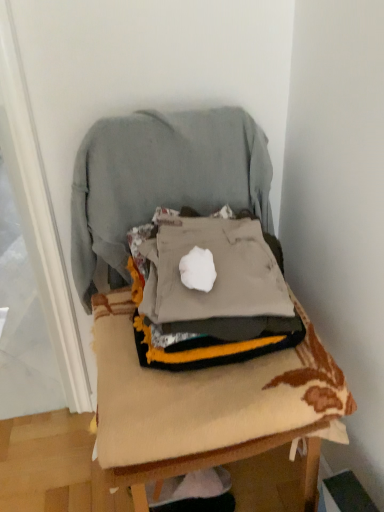
Describe the element at coordinates (203, 395) in the screenshot. This screenshot has width=384, height=512. I see `gray fabric at center` at that location.

Where is `gray cotton sweatshirt at center`? gray cotton sweatshirt at center is located at coordinates (160, 180).

From the picture: Is textured beige cushion at center at the left side of gray fabric at center?

Indeed, textured beige cushion at center is positioned on the left side of gray fabric at center.

Can you confirm if textured beige cushion at center is bigger than gray fabric at center?

Yes.

From the image's perspective, relative to gray fabric at center, is textured beige cushion at center above or below?

From the image's perspective, textured beige cushion at center appears above gray fabric at center.

Would you consider textured beige cushion at center to be distant from gray fabric at center?

That's not correct — textured beige cushion at center is a little close to gray fabric at center.

Is textured beige cushion at center oriented away from gray cotton sweatshirt at center?

Yes.

This screenshot has height=512, width=384. Identify the location of sweatshirt to the left of textured beige cushion at center. (160, 180).

From the image's perspective, does textured beige cushion at center appear lower than gray cotton sweatshirt at center?

Yes, from the image's perspective, textured beige cushion at center is below gray cotton sweatshirt at center.

How many degrees apart are the facing directions of textured beige cushion at center and gray cotton sweatshirt at center?

The angular difference between textured beige cushion at center and gray cotton sweatshirt at center is 0.00379 degrees.

Is gray cotton sweatshirt at center positioned with its back to textured beige cushion at center?

That's right, gray cotton sweatshirt at center is facing away from textured beige cushion at center.

Is gray cotton sweatshirt at center wider than textured beige cushion at center?

No, gray cotton sweatshirt at center is not wider than textured beige cushion at center.

Which is in front, point (190, 151) or point (309, 488)?

Point (190, 151)

Which object is wider, gray fabric at center or textured beige cushion at center?

textured beige cushion at center is wider.

From the image's perspective, would you say gray fabric at center is positioned over textured beige cushion at center?

Actually, gray fabric at center appears below textured beige cushion at center in the image.

How different are the orientations of gray fabric at center and gray cotton sweatshirt at center in degrees?

gray fabric at center and gray cotton sweatshirt at center are facing 1.44 degrees away from each other.

The width and height of the screenshot is (384, 512). I want to click on sweatshirt lying on the left of gray fabric at center, so click(160, 180).

Is gray cotton sweatshirt at center completely or partially inside gray fabric at center?

Definitely not — gray cotton sweatshirt at center is not inside gray fabric at center.

Is gray fabric at center not near gray cotton sweatshirt at center?

No, there isn't a large distance between gray fabric at center and gray cotton sweatshirt at center.

From the image's perspective, is gray cotton sweatshirt at center on top of gray fabric at center?

Yes, from the image's perspective, gray cotton sweatshirt at center is on top of gray fabric at center.

Is the surface of gray cotton sweatshirt at center in direct contact with gray fabric at center?

No, gray cotton sweatshirt at center is not beside gray fabric at center.

Is gray cotton sweatshirt at center looking in the opposite direction of gray fabric at center?

No.

In the image, is gray cotton sweatshirt at center on the left side or the right side of gray fabric at center?

From the image, it's evident that gray cotton sweatshirt at center is to the left of gray fabric at center.

This screenshot has width=384, height=512. In order to click on furniture above the gray fabric at center (from a real-world perspective) in this screenshot , I will do `click(188, 465)`.

Locate an element on the screen. This screenshot has width=384, height=512. furniture to the right of gray cotton sweatshirt at center is located at coordinates (188, 465).

When comparing their distances from gray cotton sweatshirt at center, does gray fabric at center or textured beige cushion at center seem closer?

textured beige cushion at center lies closer to gray cotton sweatshirt at center than the other object.

Based on their spatial positions, is gray cotton sweatshirt at center or gray fabric at center closer to textured beige cushion at center?

Based on the image, gray fabric at center appears to be nearer to textured beige cushion at center.

Consider the image. Looking at the image, which one is located closer to textured beige cushion at center, gray fabric at center or gray cotton sweatshirt at center?

Among the two, gray fabric at center is located nearer to textured beige cushion at center.

From the image, which object appears to be nearer to gray fabric at center, textured beige cushion at center or gray cotton sweatshirt at center?

textured beige cushion at center is closer to gray fabric at center.

Looking at the image, which one is located closer to gray cotton sweatshirt at center, textured beige cushion at center or gray fabric at center?

Among the two, textured beige cushion at center is located nearer to gray cotton sweatshirt at center.

Considering their positions, is gray cotton sweatshirt at center positioned further to gray fabric at center than textured beige cushion at center?

gray cotton sweatshirt at center.

What are the coordinates of `sheet between textured beige cushion at center and gray cotton sweatshirt at center in the front-back direction` in the screenshot? It's located at (203, 395).